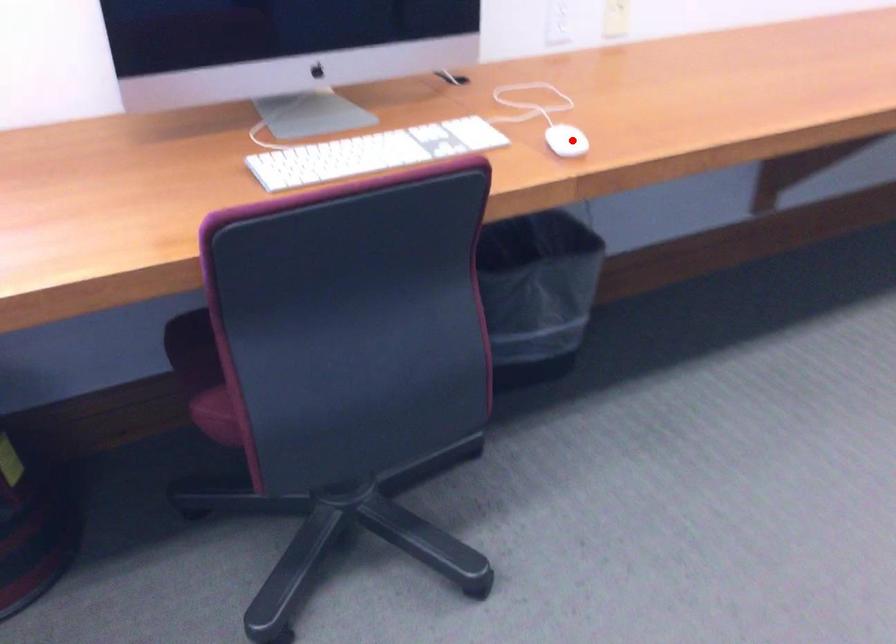
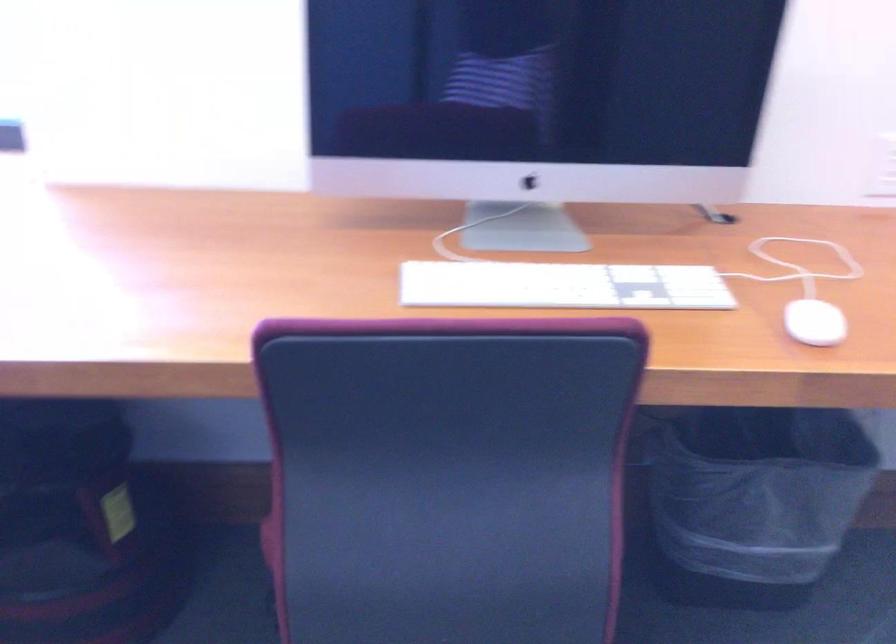
In the second image, find the point that corresponds to the highlighted location in the first image.

(814, 323)